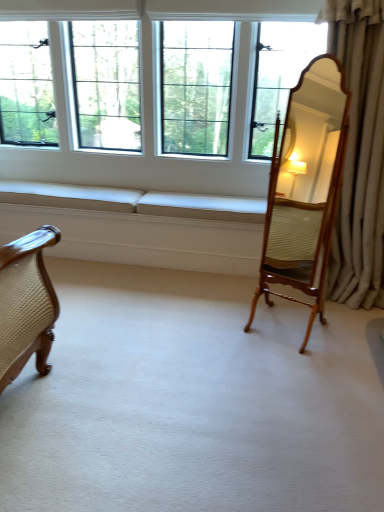
This screenshot has height=512, width=384. Describe the element at coordinates (150, 100) in the screenshot. I see `clear glass windows at center` at that location.

At what (x,y) coordinates should I click in order to perform the action: click on beige fabric couch at lower left. Please return your answer as a coordinate pair (x, y). Looking at the image, I should click on (139, 226).

Image resolution: width=384 pixels, height=512 pixels. Describe the element at coordinates (359, 154) in the screenshot. I see `silky beige curtain at right` at that location.

In order to click on clear glass windows at center in this screenshot , I will do `click(150, 100)`.

Would you say silky beige curtain at right is a long distance from clear glass windows at center?

Indeed, silky beige curtain at right is not near clear glass windows at center.

Who is shorter, silky beige curtain at right or clear glass windows at center?

clear glass windows at center is shorter.

In the scene shown: Which is more to the left, silky beige curtain at right or clear glass windows at center?

Positioned to the left is clear glass windows at center.

Considering the sizes of objects clear glass windows at center and wooden mirror at right in the image provided, who is shorter, clear glass windows at center or wooden mirror at right?

clear glass windows at center is shorter.

Can wooden mirror at right be found inside clear glass windows at center?

No, wooden mirror at right is not inside clear glass windows at center.

Based on their positions, is clear glass windows at center located to the left or right of wooden mirror at right?

Clearly, clear glass windows at center is on the left of wooden mirror at right in the image.

Consider the image. From the image's perspective, relative to silky beige curtain at right, is clear glass windows at center above or below?

clear glass windows at center is situated higher than silky beige curtain at right in the image.

Which is farther from the camera, (x=144, y=11) or (x=334, y=296)?

The point (x=144, y=11) is farther.

Is clear glass windows at center facing towards silky beige curtain at right?

No, clear glass windows at center does not turn towards silky beige curtain at right.

Can you confirm if clear glass windows at center is smaller than silky beige curtain at right?

Actually, clear glass windows at center might be larger than silky beige curtain at right.

From the image's perspective, between beige fabric couch at lower left and clear glass windows at center, who is located below?

beige fabric couch at lower left, from the image's perspective.

Would you say beige fabric couch at lower left is a long distance from clear glass windows at center?

No, there isn't a large distance between beige fabric couch at lower left and clear glass windows at center.

Does point (234, 229) lie behind point (187, 1)?

Yes, point (234, 229) is farther from viewer.

Measure the distance between beige fabric couch at lower left and clear glass windows at center.

beige fabric couch at lower left is 23.55 inches from clear glass windows at center.

Considering the sizes of beige fabric couch at lower left and wooden mirror at right in the image, is beige fabric couch at lower left bigger or smaller than wooden mirror at right?

beige fabric couch at lower left is bigger than wooden mirror at right.

From the image's perspective, which one is positioned lower, beige fabric couch at lower left or wooden mirror at right?

beige fabric couch at lower left is shown below in the image.

Is point (65, 236) closer to camera compared to point (305, 186)?

Yes, it is.

Which object is wider, beige fabric couch at lower left or wooden mirror at right?

beige fabric couch at lower left is wider.

Which object is wider, clear glass windows at center or beige fabric couch at lower left?

clear glass windows at center is wider.

Are clear glass windows at center and beige fabric couch at lower left located far from each other?

That's not correct — clear glass windows at center is a little close to beige fabric couch at lower left.

Considering their positions, is clear glass windows at center located in front of or behind beige fabric couch at lower left?

clear glass windows at center is in front of beige fabric couch at lower left.

Is silky beige curtain at right behind wooden mirror at right?

Yes, silky beige curtain at right is behind wooden mirror at right.

From the image's perspective, would you say silky beige curtain at right is shown under wooden mirror at right?

No, from the image's perspective, silky beige curtain at right is not below wooden mirror at right.

Considering the positions of objects silky beige curtain at right and wooden mirror at right in the image provided, who is more to the left, silky beige curtain at right or wooden mirror at right?

wooden mirror at right is more to the left.

Where is `curtain below the clear glass windows at center (from the image's perspective)`? The height and width of the screenshot is (512, 384). curtain below the clear glass windows at center (from the image's perspective) is located at coordinates (359, 154).

This screenshot has width=384, height=512. In order to click on mirror in front of the clear glass windows at center in this screenshot , I will do `click(306, 180)`.

Based on their spatial positions, is silky beige curtain at right or clear glass windows at center closer to beige fabric couch at lower left?

clear glass windows at center lies closer to beige fabric couch at lower left than the other object.

Looking at the image, which one is located closer to wooden mirror at right, clear glass windows at center or beige fabric couch at lower left?

clear glass windows at center is positioned closer to the anchor wooden mirror at right.

When comparing their distances from clear glass windows at center, does wooden mirror at right or silky beige curtain at right seem closer?

wooden mirror at right lies closer to clear glass windows at center than the other object.

Looking at this image, considering their positions, is beige fabric couch at lower left positioned further to clear glass windows at center than wooden mirror at right?

wooden mirror at right is positioned further to the anchor clear glass windows at center.

Based on their spatial positions, is beige fabric couch at lower left or wooden mirror at right further from silky beige curtain at right?

Based on the image, beige fabric couch at lower left appears to be further to silky beige curtain at right.

Which object lies further to the anchor point silky beige curtain at right, beige fabric couch at lower left or clear glass windows at center?

Based on the image, beige fabric couch at lower left appears to be further to silky beige curtain at right.

Estimate the real-world distances between objects in this image. Which object is closer to clear glass windows at center, silky beige curtain at right or beige fabric couch at lower left?

Among the two, beige fabric couch at lower left is located nearer to clear glass windows at center.

Which object lies nearer to the anchor point beige fabric couch at lower left, wooden mirror at right or clear glass windows at center?

The object closer to beige fabric couch at lower left is clear glass windows at center.

The image size is (384, 512). I want to click on mirror situated between clear glass windows at center and silky beige curtain at right from left to right, so click(x=306, y=180).

The width and height of the screenshot is (384, 512). In order to click on mirror between beige fabric couch at lower left and silky beige curtain at right in the horizontal direction in this screenshot , I will do `click(306, 180)`.

You are a GUI agent. You are given a task and a screenshot of the screen. Output one action in this format:
    pyautogui.click(x=<x>, y=<y>)
    Task: Click on the window between beige fabric couch at lower left and silky beige curtain at right in the horizontal direction
    
    Given the screenshot: What is the action you would take?
    pyautogui.click(x=150, y=100)

I want to click on window located between beige fabric couch at lower left and wooden mirror at right in the left-right direction, so click(150, 100).